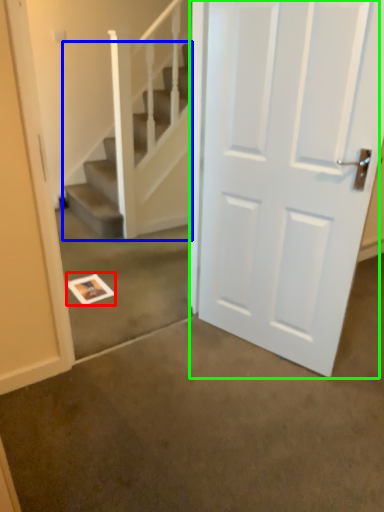
Question: Which object is positioned farthest from postcard (highlighted by a red box)? Select from stairs (highlighted by a blue box) and door (highlighted by a green box).

Choices:
 (A) stairs
 (B) door

Answer: (B)